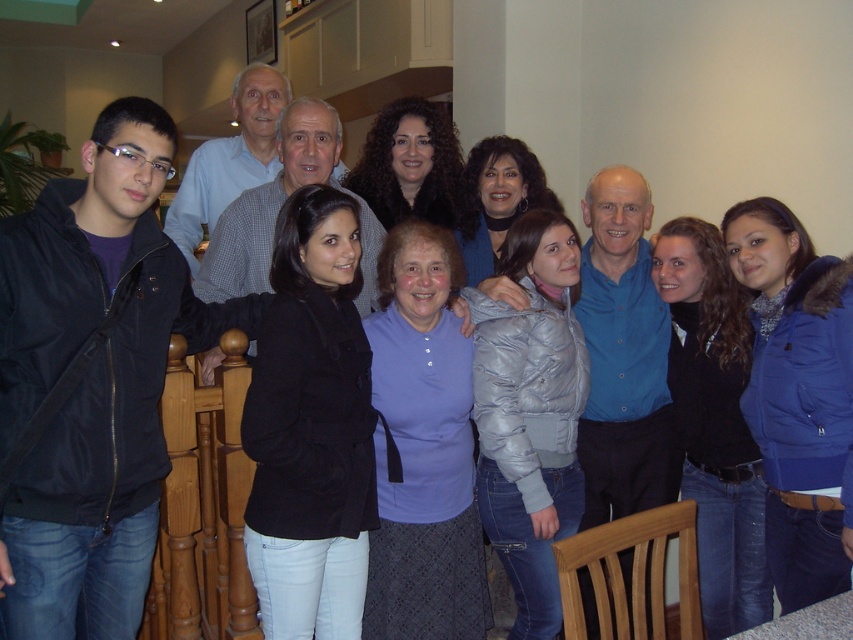
Who is positioned more to the left, purple fabric shirt at center or shiny silver jacket at center?

purple fabric shirt at center

From the picture: Measure the distance between purple fabric shirt at center and shiny silver jacket at center.

purple fabric shirt at center is 85.67 centimeters away from shiny silver jacket at center.

Who is more forward, (x=372, y=561) or (x=483, y=202)?

Positioned in front is point (x=372, y=561).

The width and height of the screenshot is (853, 640). Find the location of `purple fabric shirt at center`. purple fabric shirt at center is located at coordinates (422, 449).

Can you confirm if black matte jacket at center is shorter than purple fabric shirt at center?

Yes, black matte jacket at center is shorter than purple fabric shirt at center.

Can you confirm if black matte jacket at center is wider than purple fabric shirt at center?

Incorrect, black matte jacket at center's width does not surpass purple fabric shirt at center's.

Who is more distant from viewer, [283,396] or [431,362]?

Point [431,362]

Identify the location of black matte jacket at center. (311, 428).

Is silver puffy jacket at center thinner than dark blue puffy jacket at center?

In fact, silver puffy jacket at center might be wider than dark blue puffy jacket at center.

Who is positioned more to the left, silver puffy jacket at center or dark blue puffy jacket at center?

Positioned to the left is silver puffy jacket at center.

Which is in front, point (520, 618) or point (740, 360)?

Point (520, 618) is in front.

You are a GUI agent. You are given a task and a screenshot of the screen. Output one action in this format:
    pyautogui.click(x=<x>, y=<y>)
    Task: Click on the silver puffy jacket at center
    
    Given the screenshot: What is the action you would take?
    pyautogui.click(x=531, y=413)